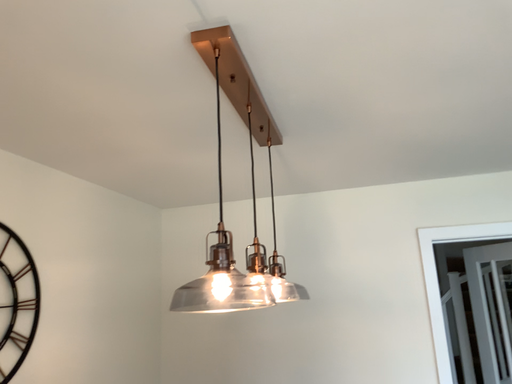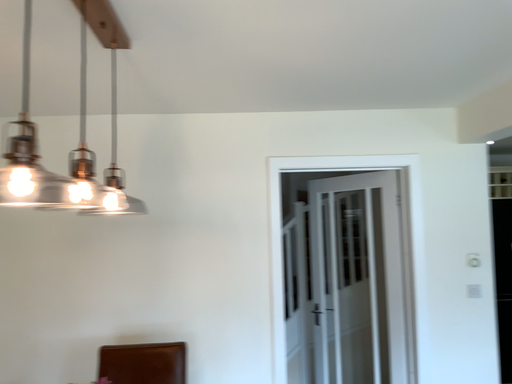
Question: Which way did the camera rotate in the video?

Choices:
 (A) rotated upward
 (B) rotated downward

Answer: (B)